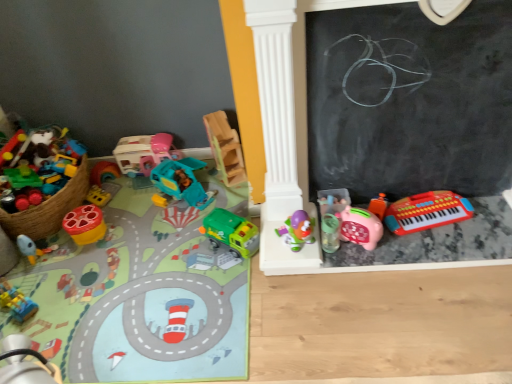
This screenshot has width=512, height=384. Find the location of `vacant point to the left of wooden blocks at center, which is the 7th toy from left to right`. vacant point to the left of wooden blocks at center, which is the 7th toy from left to right is located at coordinates (210, 176).